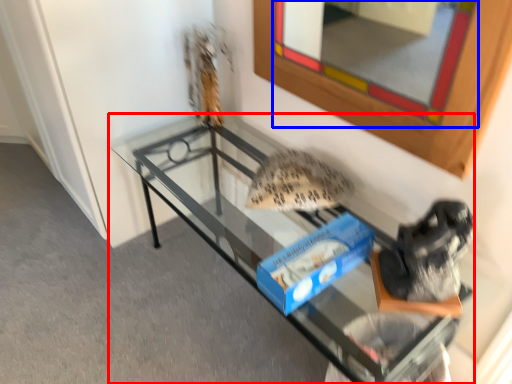
Question: Which object appears closest to the camera in this image, furniture (highlighted by a red box) or mirror (highlighted by a blue box)?

Choices:
 (A) furniture
 (B) mirror

Answer: (B)